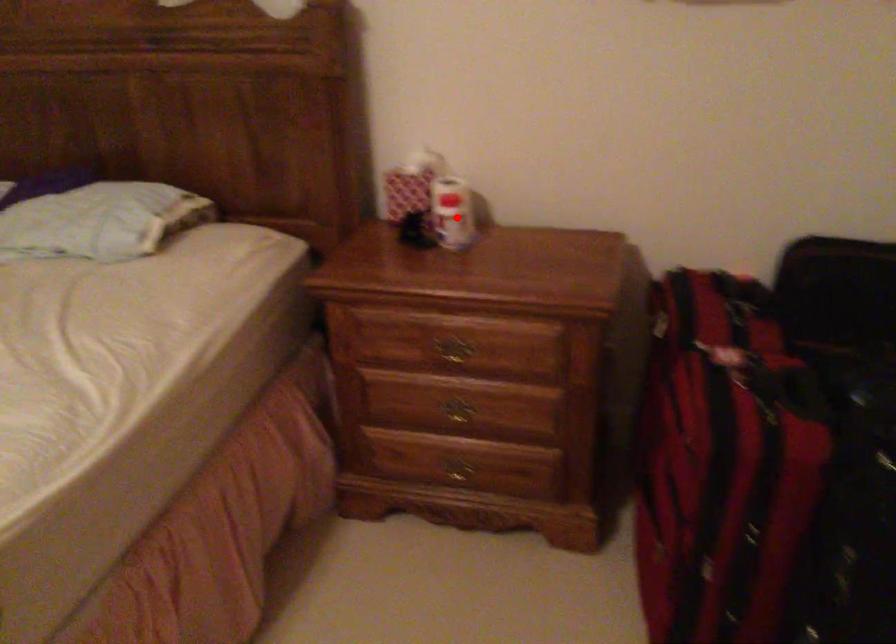
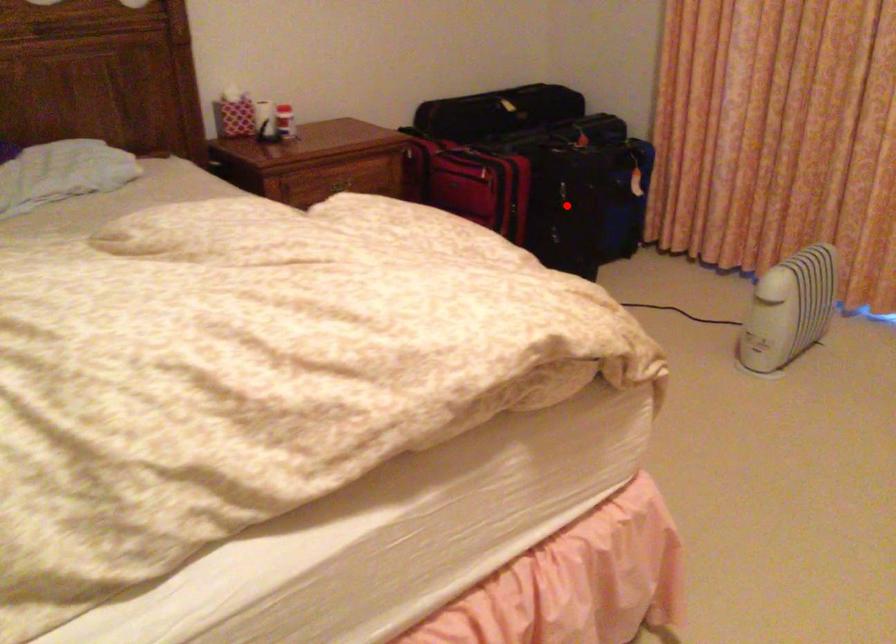
I am providing you with two images of the same scene from different viewpoints. A red point is marked on the first image and another point is marked on the second image. Is the red point in image1 aligned with the point shown in image2?

No